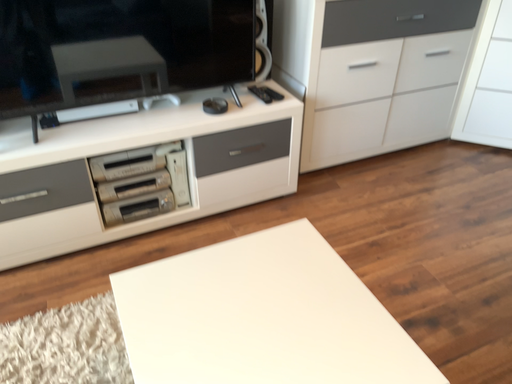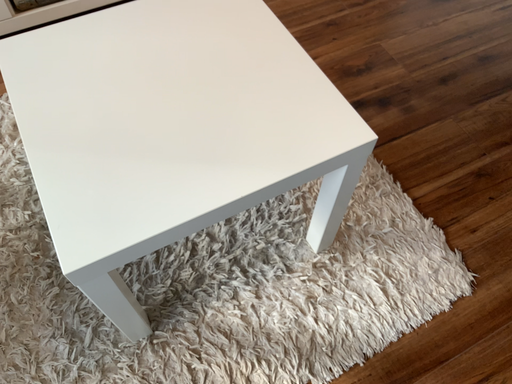
Question: Which way did the camera rotate in the video?

Choices:
 (A) rotated upward
 (B) rotated downward

Answer: (B)